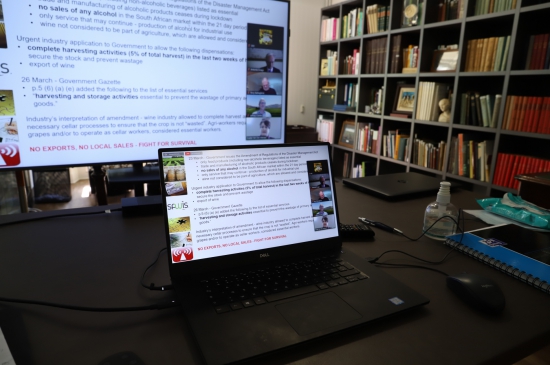
Image resolution: width=550 pixels, height=365 pixels. Identify the location of laptop. click(353, 289), click(390, 193).